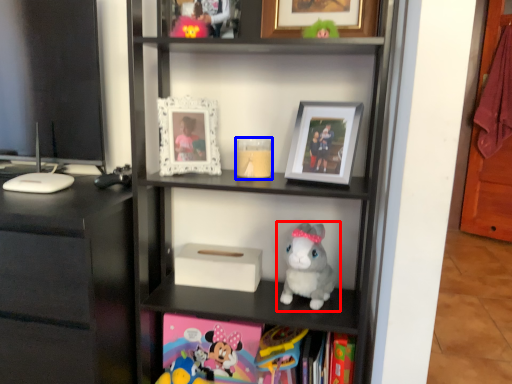
Question: Among these objects, which one is farthest to the camera, toy (highlighted by a red box) or candle holder (highlighted by a blue box)?

Choices:
 (A) toy
 (B) candle holder

Answer: (B)